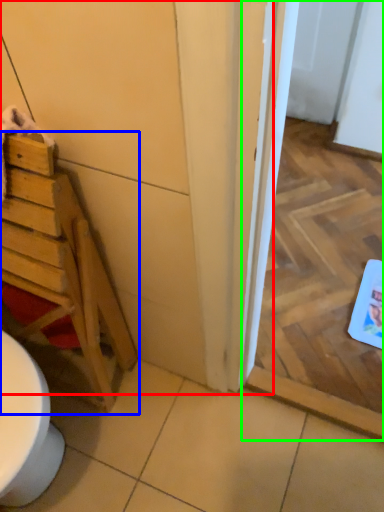
Question: Which object is positioned farthest from door (highlighted by a red box)? Select from furniture (highlighted by a blue box) and screen door (highlighted by a green box).

Choices:
 (A) furniture
 (B) screen door

Answer: (B)